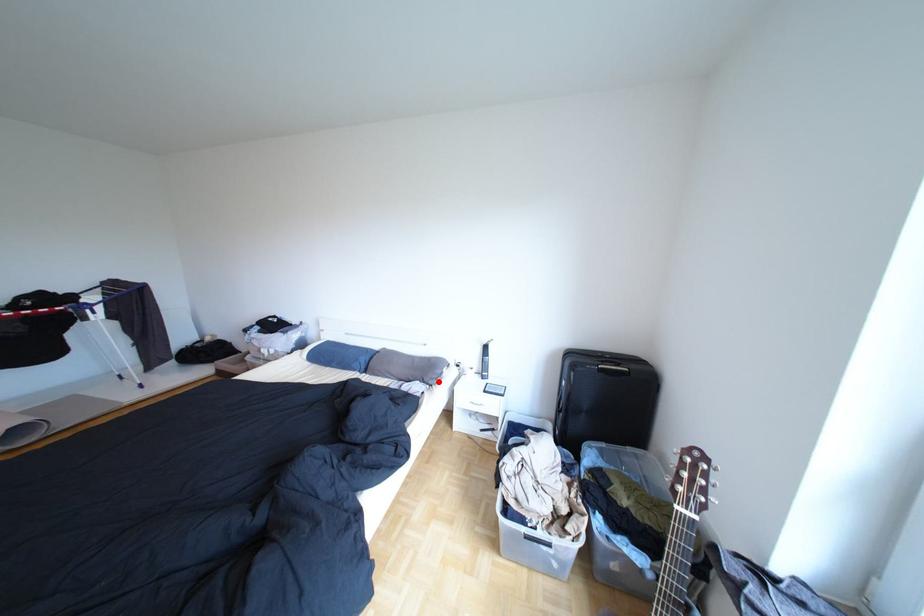
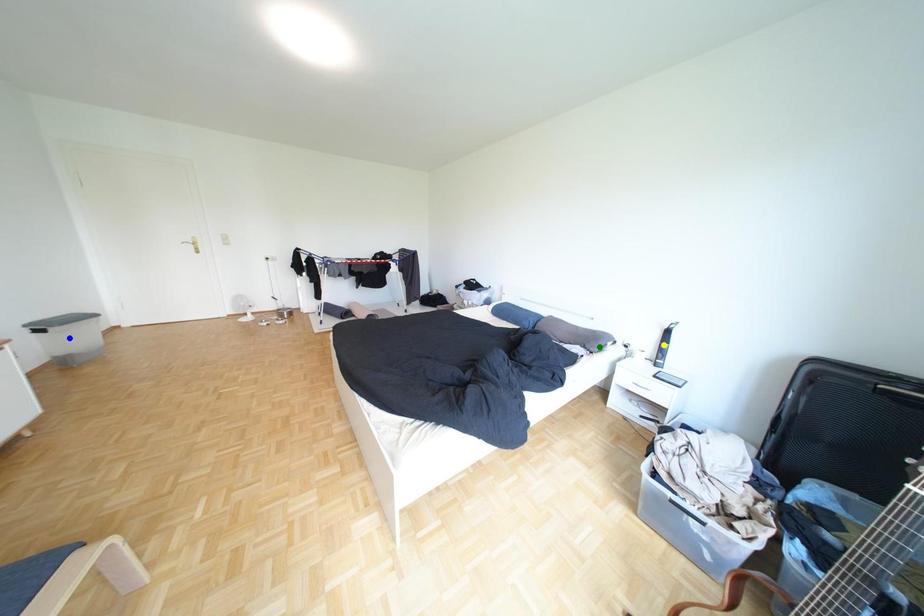
Question: I am providing you with two images of the same scene from different viewpoints. A red point is marked on the first image. You are given multiple points on the second image. In image 2, which mark is for the same physical point as the one in image 1?

Choices:
 (A) green point
 (B) yellow point
 (C) blue point

Answer: (A)